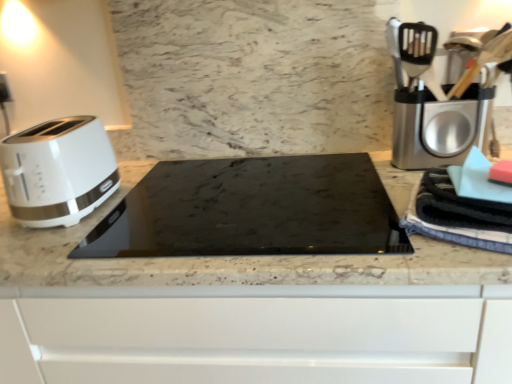
Question: Is marble at center closer to camera compared to white glossy toaster at left?

Choices:
 (A) no
 (B) yes

Answer: (B)

Question: Is marble at center outside of white glossy toaster at left?

Choices:
 (A) yes
 (B) no

Answer: (A)

Question: Is marble at center to the left of white glossy toaster at left from the viewer's perspective?

Choices:
 (A) yes
 (B) no

Answer: (B)

Question: Is the surface of marble at center in direct contact with white glossy toaster at left?

Choices:
 (A) no
 (B) yes

Answer: (A)

Question: Does marble at center have a greater width compared to white glossy toaster at left?

Choices:
 (A) yes
 (B) no

Answer: (A)

Question: Is white glossy toaster at left spatially inside black glass cooktop at center, or outside of it?

Choices:
 (A) outside
 (B) inside

Answer: (A)

Question: Considering the positions of white glossy toaster at left and black glass cooktop at center in the image, is white glossy toaster at left taller or shorter than black glass cooktop at center?

Choices:
 (A) short
 (B) tall

Answer: (B)

Question: Considering the positions of point (74, 167) and point (126, 238), is point (74, 167) closer or farther from the camera than point (126, 238)?

Choices:
 (A) closer
 (B) farther

Answer: (B)

Question: Relative to black glass cooktop at center, is white glossy toaster at left in front or behind?

Choices:
 (A) front
 (B) behind

Answer: (B)

Question: Is white glossy toaster at left to the left or to the right of blue striped towel at right in the image?

Choices:
 (A) right
 (B) left

Answer: (B)

Question: Considering the positions of white glossy toaster at left and blue striped towel at right in the image, is white glossy toaster at left bigger or smaller than blue striped towel at right?

Choices:
 (A) big
 (B) small

Answer: (A)

Question: From their relative heights in the image, would you say white glossy toaster at left is taller or shorter than blue striped towel at right?

Choices:
 (A) short
 (B) tall

Answer: (B)

Question: Looking at their shapes, would you say white glossy toaster at left is wider or thinner than blue striped towel at right?

Choices:
 (A) thin
 (B) wide

Answer: (B)

Question: Considering the positions of black glass cooktop at center and white glossy toaster at left in the image, is black glass cooktop at center bigger or smaller than white glossy toaster at left?

Choices:
 (A) big
 (B) small

Answer: (A)

Question: Is black glass cooktop at center situated inside white glossy toaster at left or outside?

Choices:
 (A) inside
 (B) outside

Answer: (B)